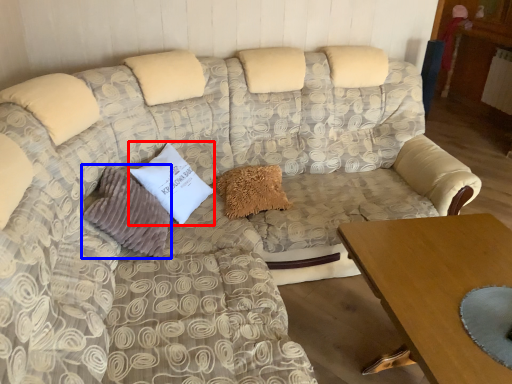
Question: Which object is further to the camera taking this photo, pillow (highlighted by a red box) or pillow (highlighted by a blue box)?

Choices:
 (A) pillow
 (B) pillow

Answer: (A)